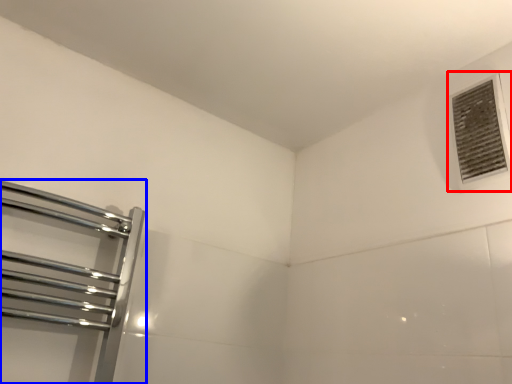
Question: Which of the following is the farthest to the observer, air conditioning (highlighted by a red box) or towel rack (highlighted by a blue box)?

Choices:
 (A) air conditioning
 (B) towel rack

Answer: (A)